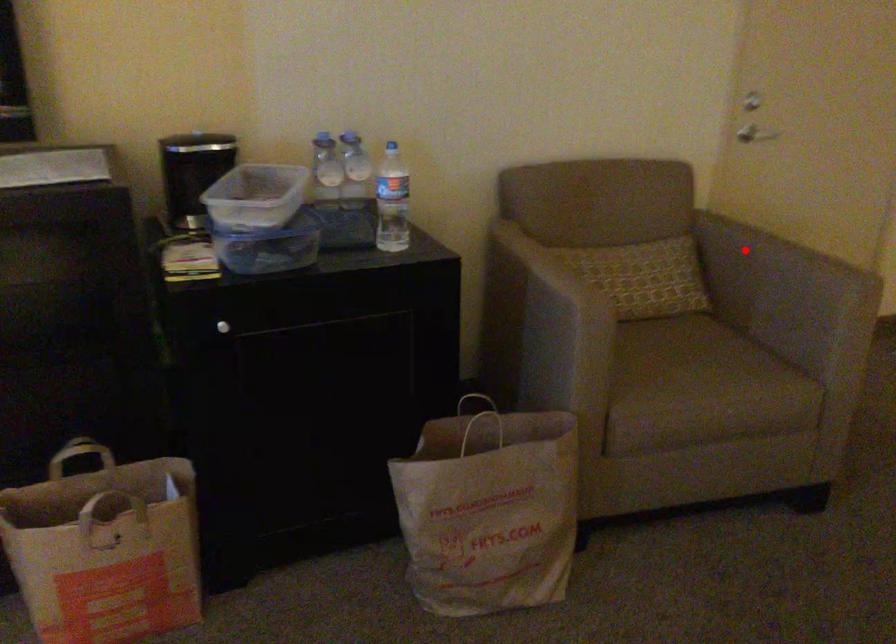
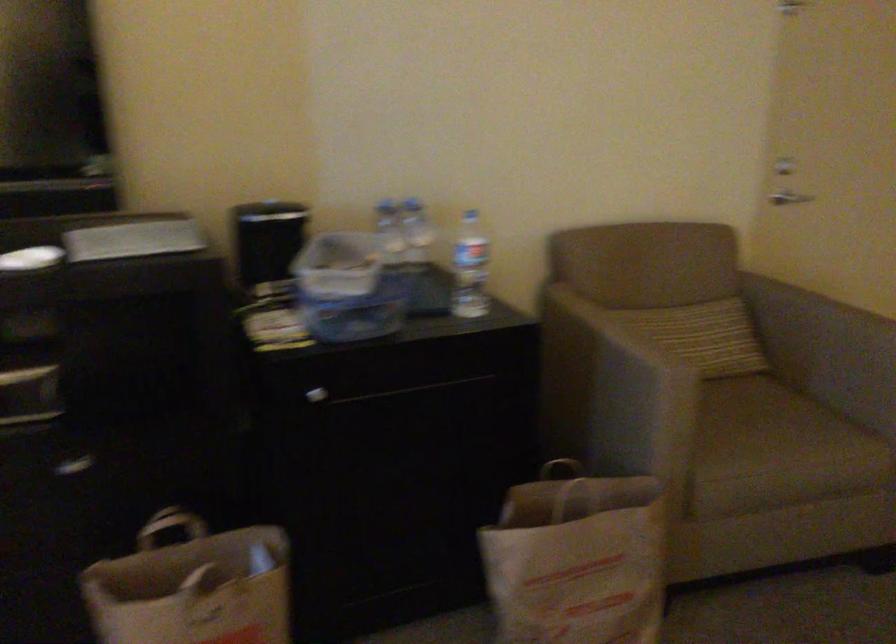
Question: I am providing you with two images of the same scene from different viewpoints. A red point is marked on the first image. At the location where the point appears in image 1, is it still visible in image 2?

Choices:
 (A) Yes
 (B) No

Answer: (A)